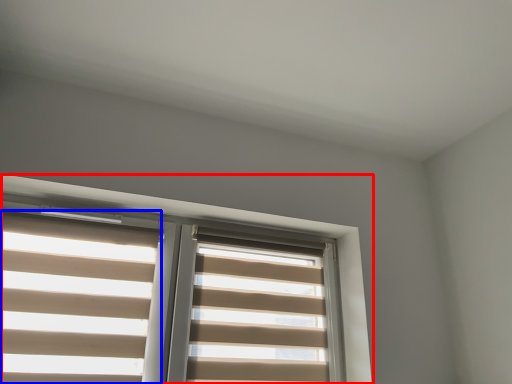
Question: Among these objects, which one is nearest to the camera, window (highlighted by a red box) or blind (highlighted by a blue box)?

Choices:
 (A) window
 (B) blind

Answer: (A)